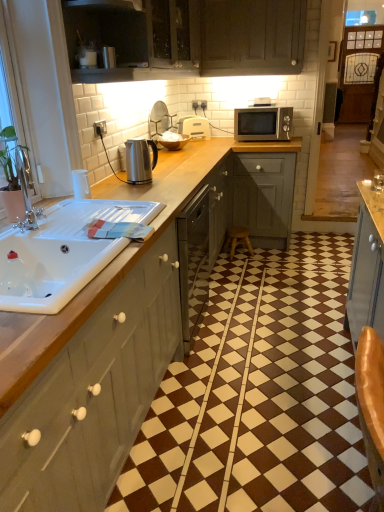
Locate an element on the screen. free spot below wooden stool at center (from a real-world perspective) is located at coordinates (250, 252).